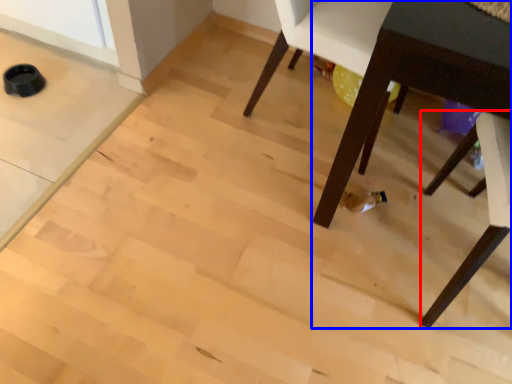
Question: Which point is closer to the camera, chair (highlighted by a red box) or table (highlighted by a blue box)?

Choices:
 (A) chair
 (B) table

Answer: (B)